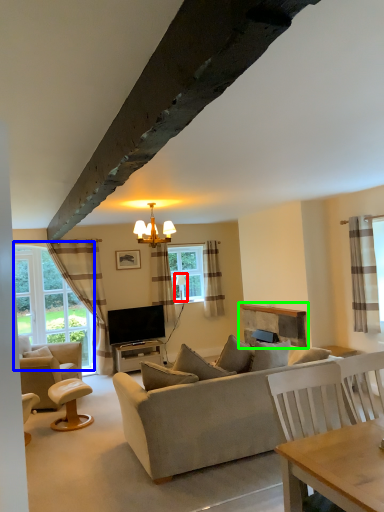
Question: Which object is the farthest from lamp (highlighted by a red box)? Choose among these: bay window (highlighted by a blue box) or fireplace (highlighted by a green box).

Choices:
 (A) bay window
 (B) fireplace

Answer: (A)